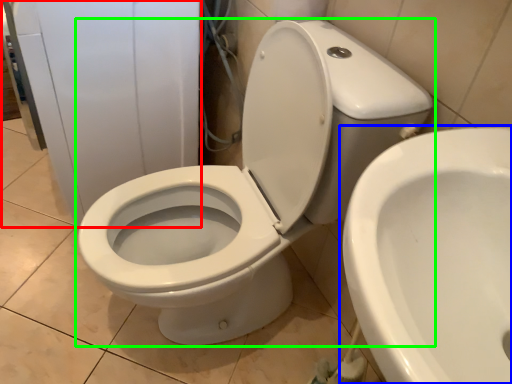
Question: Considering the real-world distances, which object is closest to porcelain (highlighted by a red box)? toilet (highlighted by a blue box) or toilet (highlighted by a green box).

Choices:
 (A) toilet
 (B) toilet

Answer: (B)